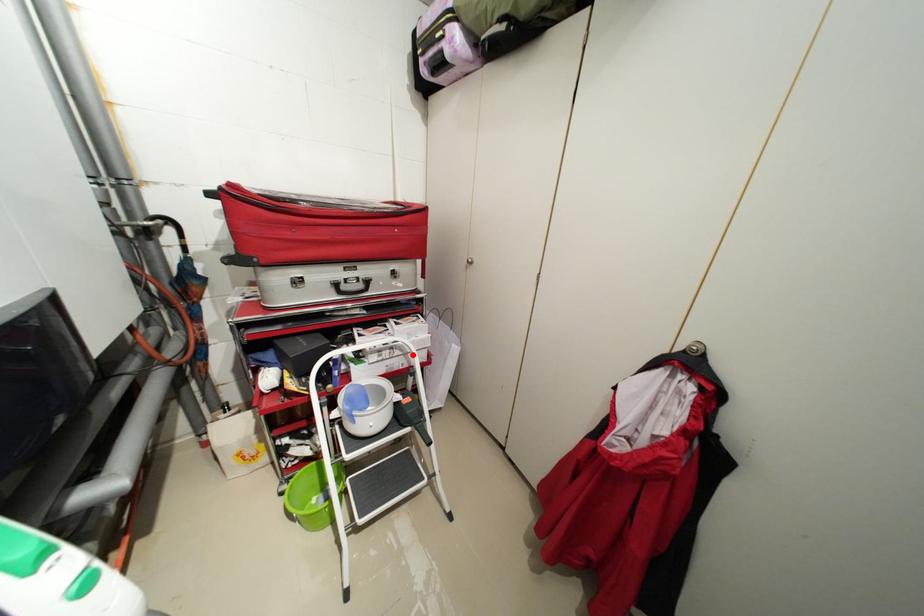
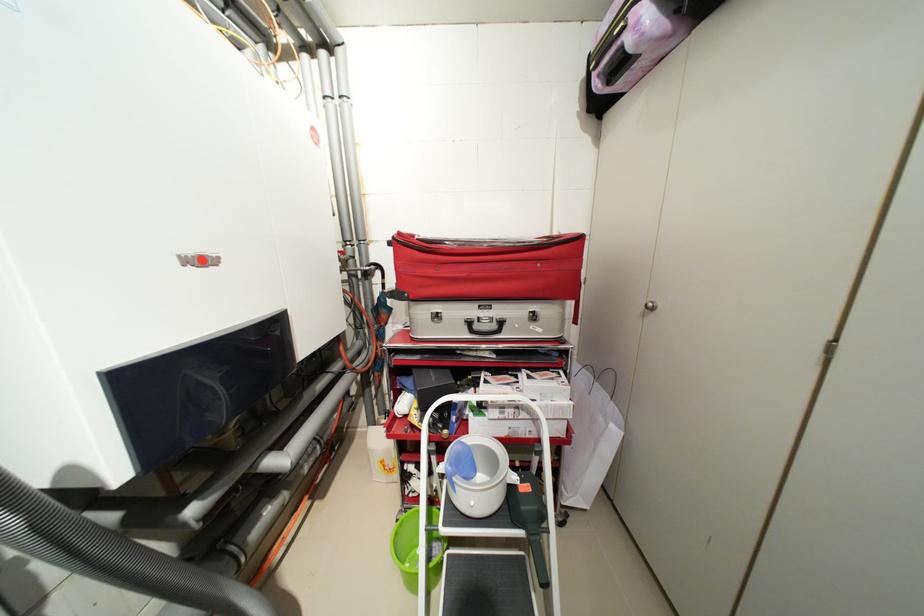
In the second image, find the point that corresponds to the highlighted location in the first image.

(541, 421)